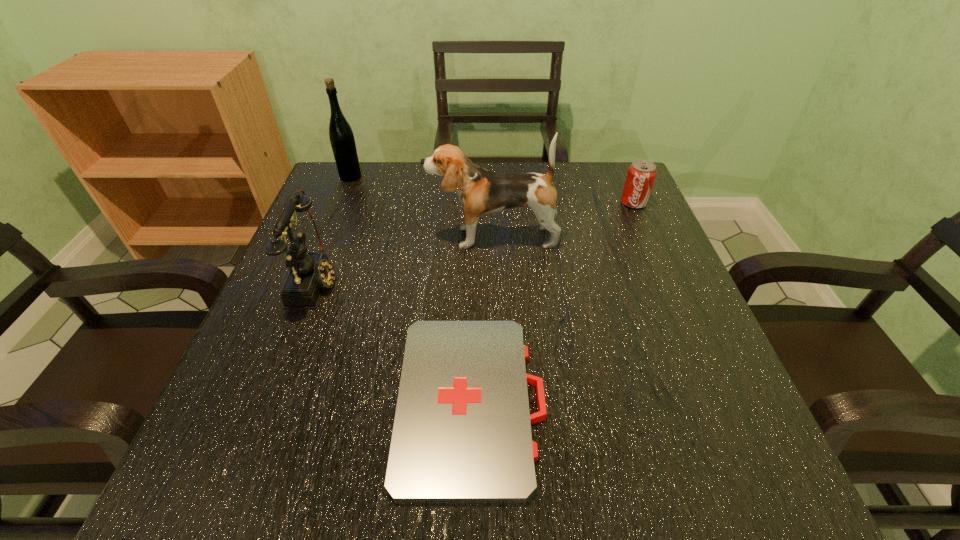
Locate an element on the screen. object present at the far left corner is located at coordinates (342, 140).

The height and width of the screenshot is (540, 960). Find the location of `object located in the far right corner section of the desktop`. object located in the far right corner section of the desktop is located at coordinates (641, 174).

The image size is (960, 540). In the image, there is a desktop. Identify the location of vacant space at the far edge. (529, 212).

Where is `vacant space at the near edge of the desktop`? This screenshot has width=960, height=540. vacant space at the near edge of the desktop is located at coordinates (628, 502).

Image resolution: width=960 pixels, height=540 pixels. In order to click on vacant region at the left edge of the desktop in this screenshot , I will do `click(245, 373)`.

At what (x,y) coordinates should I click in order to perform the action: click on vacant area at the right edge. Please return your answer as a coordinate pair (x, y). The image size is (960, 540). Looking at the image, I should click on (700, 320).

You are a GUI agent. You are given a task and a screenshot of the screen. Output one action in this format:
    pyautogui.click(x=<x>, y=<y>)
    Task: Click on the vacant space at the far left corner of the desktop
    This screenshot has width=960, height=540.
    Given the screenshot: What is the action you would take?
    pyautogui.click(x=325, y=179)

This screenshot has width=960, height=540. I want to click on free space at the near left corner, so click(x=222, y=504).

At what (x,y) coordinates should I click in order to perform the action: click on vacant space at the far right corner of the desktop. Please return your answer as a coordinate pair (x, y). Looking at the image, I should click on (573, 172).

In the image, there is a desktop. Where is `blank space at the near right corner`? This screenshot has width=960, height=540. blank space at the near right corner is located at coordinates (766, 505).